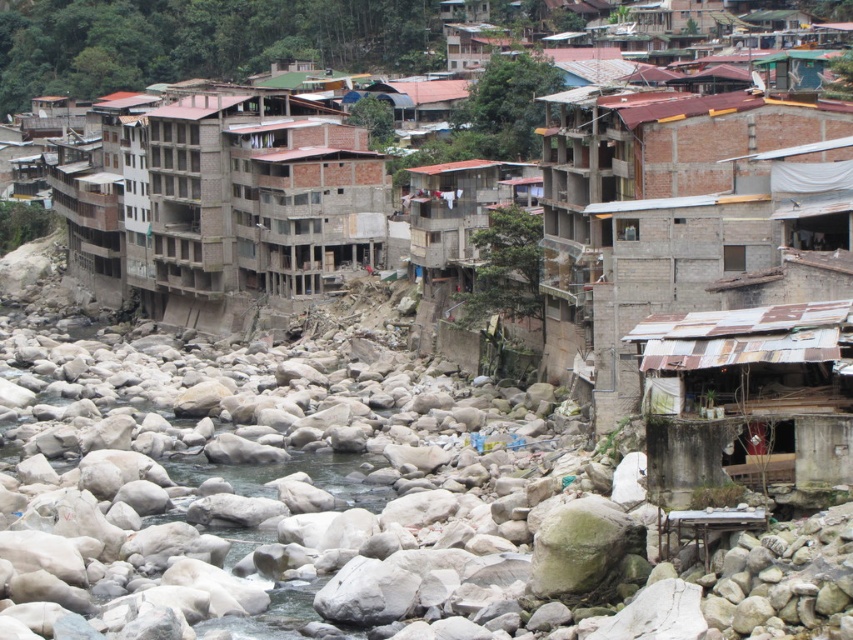
Is brown brick buildings at center closer to camera compared to rusty corrugated metal hut at lower right?

No, brown brick buildings at center is behind rusty corrugated metal hut at lower right.

Who is taller, brown brick buildings at center or rusty corrugated metal hut at lower right?

brown brick buildings at center

Between point (585, 260) and point (675, 429), which one is positioned in front?

Point (675, 429) is in front.

You are a GUI agent. You are given a task and a screenshot of the screen. Output one action in this format:
    pyautogui.click(x=<x>, y=<y>)
    Task: Click on the brown brick buildings at center
    
    Given the screenshot: What is the action you would take?
    pyautogui.click(x=625, y=188)

Does brown brick buildings at center appear over brown concrete building at center?

Yes.

Which is in front, point (648, 168) or point (183, 294)?

Point (648, 168) is in front.

Does point (82, 19) come closer to viewer compared to point (201, 131)?

No, (82, 19) is further to viewer.

Locate an element on the screen. brown brick buildings at center is located at coordinates (625, 188).

Does point (373, 253) come in front of point (814, 470)?

No.

Is brown concrete building at center to the left of rusty corrugated metal hut at lower right from the viewer's perspective?

Yes, brown concrete building at center is to the left of rusty corrugated metal hut at lower right.

Does point (138, 216) come behind point (788, 460)?

Yes, point (138, 216) is farther from viewer.

Image resolution: width=853 pixels, height=640 pixels. I want to click on brown concrete building at center, so click(x=221, y=200).